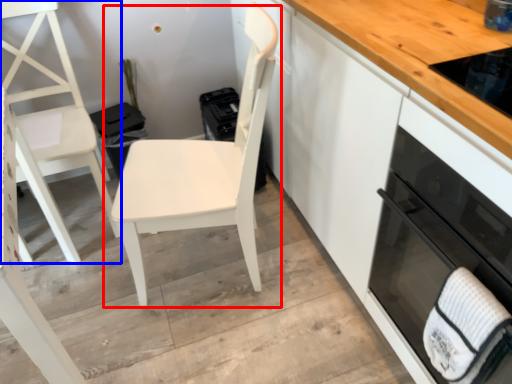
Question: Among these objects, which one is farthest to the camera, chair (highlighted by a red box) or chair (highlighted by a blue box)?

Choices:
 (A) chair
 (B) chair

Answer: (B)